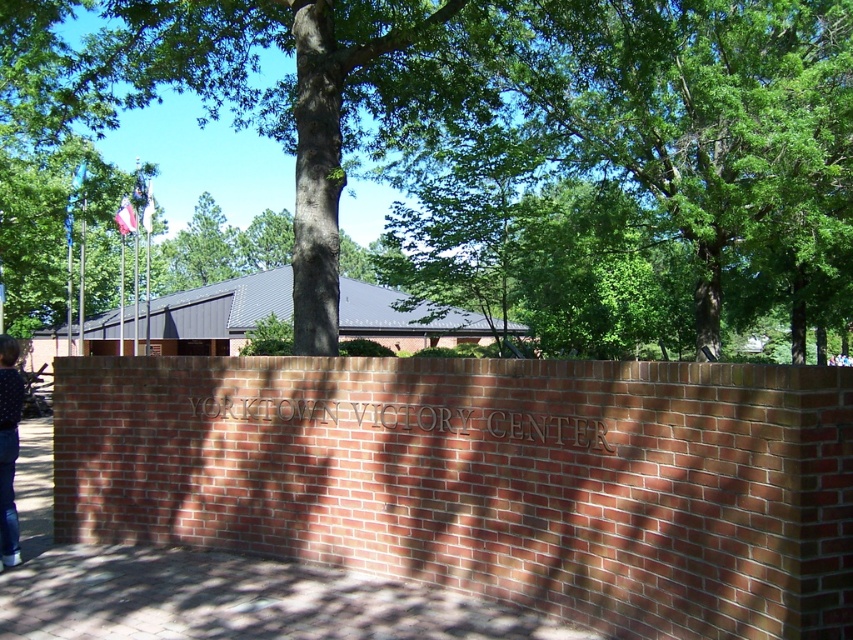
Question: Can you confirm if green leafy tree at center is positioned above blue denim jeans at lower left?

Choices:
 (A) no
 (B) yes

Answer: (B)

Question: Which of the following is the farthest from the observer?

Choices:
 (A) green leafy tree at center
 (B) blue denim jeans at lower left

Answer: (A)

Question: Is green leafy tree at center positioned in front of blue denim jeans at lower left?

Choices:
 (A) no
 (B) yes

Answer: (A)

Question: Which point is farther to the camera?

Choices:
 (A) (24, 24)
 (B) (0, 400)

Answer: (A)

Question: Is green leafy tree at center wider than blue denim jeans at lower left?

Choices:
 (A) yes
 (B) no

Answer: (A)

Question: Which of the following is the farthest from the observer?

Choices:
 (A) blue denim jeans at lower left
 (B) green leafy tree at center

Answer: (B)